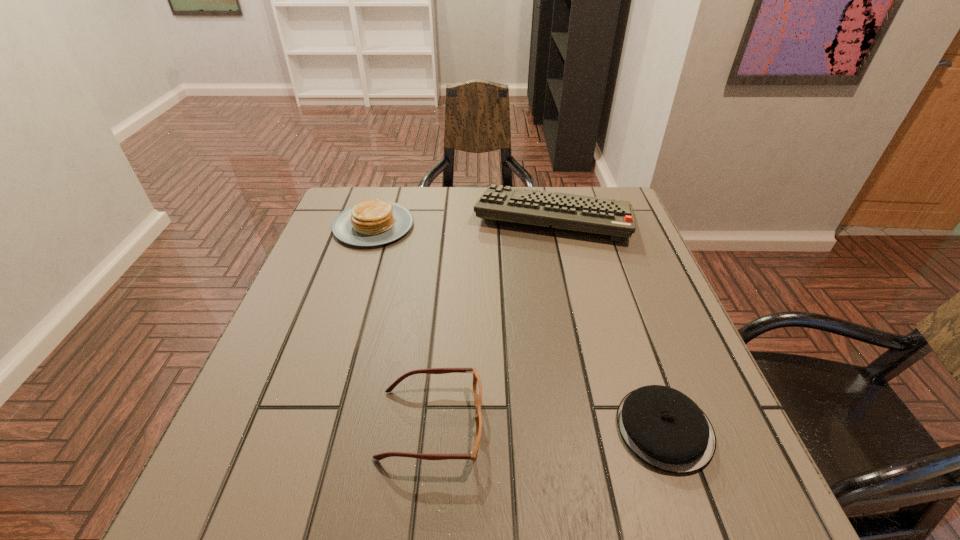
Find the location of a particular element. This screenshot has height=540, width=960. computer keyboard is located at coordinates (582, 213).

I want to click on the taller pancake, so click(x=376, y=222).

The width and height of the screenshot is (960, 540). In order to click on the left pancake in this screenshot , I will do `click(376, 222)`.

At what (x,y) coordinates should I click in order to perform the action: click on spectacles. Please return your answer as a coordinate pair (x, y). Looking at the image, I should click on [477, 386].

At what (x,y) coordinates should I click in order to perform the action: click on the nearer pancake. Please return your answer as a coordinate pair (x, y). This screenshot has height=540, width=960. Looking at the image, I should click on (663, 427).

Image resolution: width=960 pixels, height=540 pixels. I want to click on the shorter pancake, so click(x=663, y=427).

Identify the location of vacant space located 0.180m on the left of the computer keyboard. (411, 217).

This screenshot has width=960, height=540. What are the coordinates of `vacant space located 0.060m on the back of the taller pancake` in the screenshot? It's located at (384, 194).

Locate an element on the screen. vacant space located on the front-facing side of the spectacles is located at coordinates (602, 424).

The width and height of the screenshot is (960, 540). What are the coordinates of `free region located on the left of the shorter pancake` in the screenshot? It's located at (583, 429).